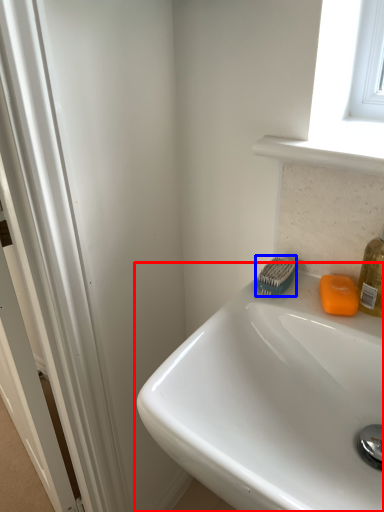
Question: Which object appears farthest to the camera in this image, sink (highlighted by a red box) or brush (highlighted by a blue box)?

Choices:
 (A) sink
 (B) brush

Answer: (B)